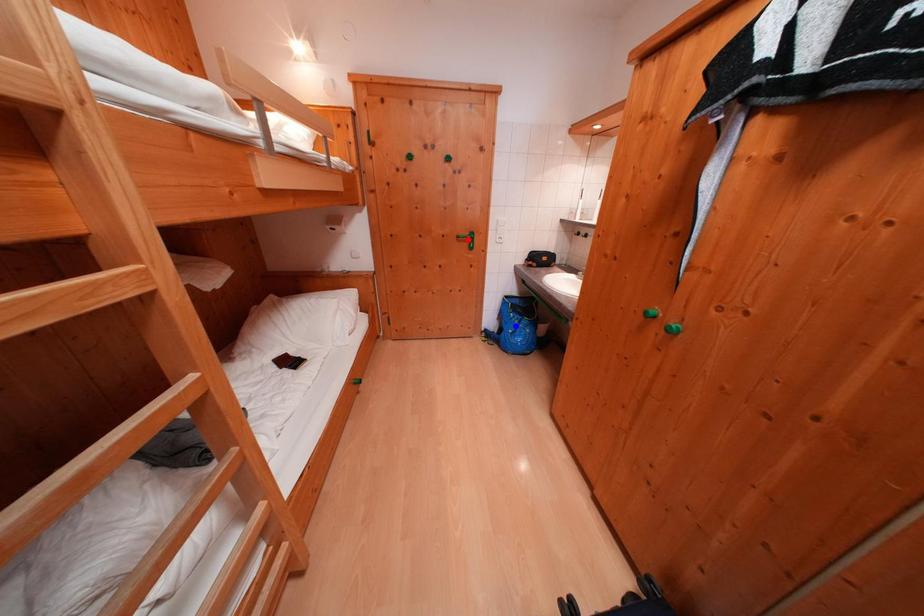
Question: Two points are marked on the image. Which point is closer to the camera?

Choices:
 (A) Blue point is closer.
 (B) Red point is closer.

Answer: (B)